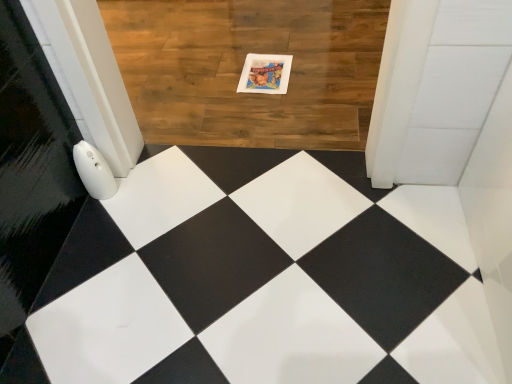
Locate an element on the screen. blank space situated above matte paper postcard at center (from a real-world perspective) is located at coordinates (263, 71).